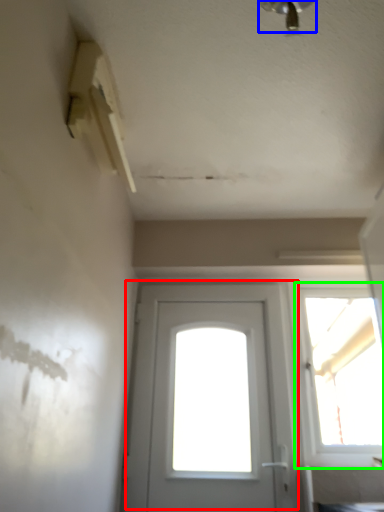
Question: Which object is positioned farthest from door (highlighted by a red box)? Select from light fixture (highlighted by a blue box) and window (highlighted by a green box).

Choices:
 (A) light fixture
 (B) window

Answer: (A)